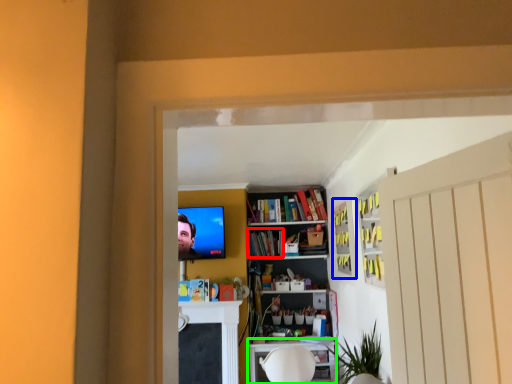
Question: Considering the real-world distances, which object is closest to book (highlighted by a red box)? cabinet (highlighted by a blue box) or table (highlighted by a green box).

Choices:
 (A) cabinet
 (B) table

Answer: (B)